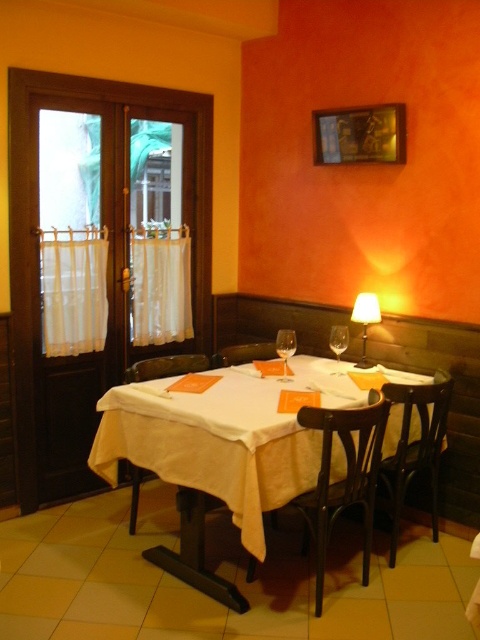
You are a customer sitting at the white matte table at center. You want to reach the matte white lampshade at upper right to adjust its light. Can you physically touch the lampshade from your seated position?

The white matte table at center is in front of the matte white lampshade at upper right, meaning the table is between you and the lampshade. Therefore, you cannot directly reach the matte white lampshade at upper right from your seated position without moving around the table.

You are a server carrying a tray of food and need to navigate from the kitchen entrance to the dark wood chair at center without bumping into the matte white lampshade at upper right. What is the minimum distance you should maintain between your tray and the lampshade to safely reach the chair?

The minimum distance you should maintain between your tray and the matte white lampshade at upper right is 35.15 inches. This ensures you can safely navigate to the dark wood chair at center without collision.